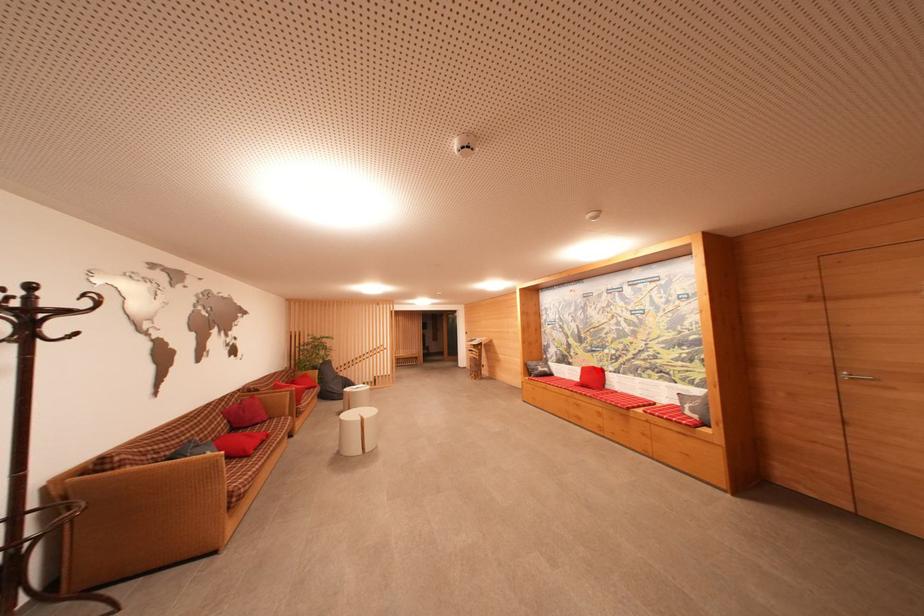
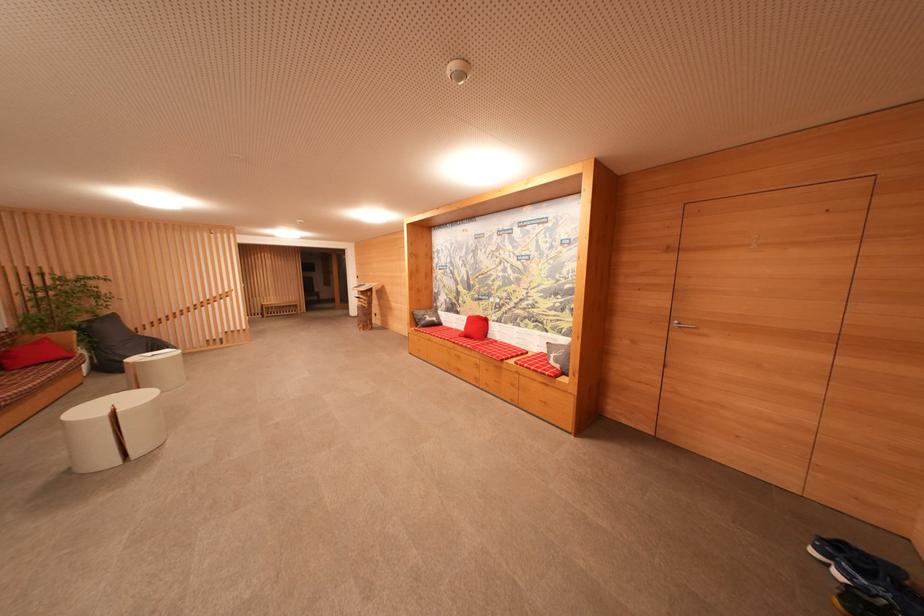
The point at the highlighted location is marked in the first image. Where is the corresponding point in the second image?

(482, 321)